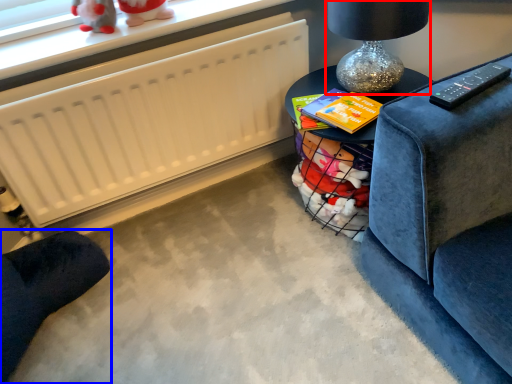
Question: Which object appears farthest to the camera in this image, table lamp (highlighted by a red box) or furniture (highlighted by a blue box)?

Choices:
 (A) table lamp
 (B) furniture

Answer: (A)